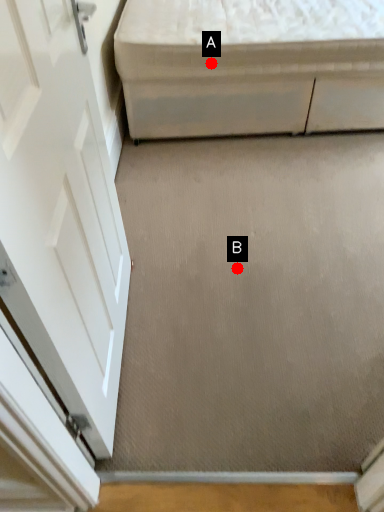
Question: Two points are circled on the image, labeled by A and B beside each circle. Which point is further to the camera?

Choices:
 (A) A is further
 (B) B is further

Answer: (A)